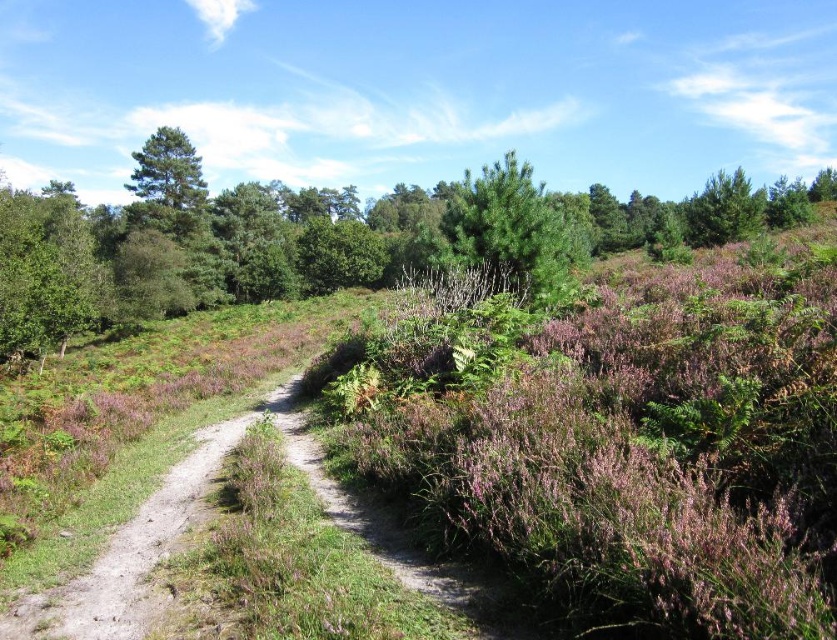
You are standing at the center of the dirt path in the heathland scene. You want to walk towards the green leafy tree at left. Which direction should you head?

The green leafy tree at left is located at the left side of the scene, so you should head towards the left direction to reach it.

You are planning a photography session and want to capture both the green leafy tree at left and the green matte tree at center in your shot. Which tree should you position closer to the camera to ensure both are fully visible in the frame?

To ensure both the green leafy tree at left and the green matte tree at center are fully visible in the frame, position the shorter green leafy tree at left closer to the camera since it is shorter than the green matte tree at center. This way, the height difference will be minimized, allowing both trees to fit within the photograph.

You are planning a photography session and want to capture both the green leafy tree at left and the green matte tree at center in your frame. Which tree should you focus on first if you want to ensure both are in the same shot?

You should focus on the green leafy tree at left first because it is bigger and will require more space in the frame to capture its entirety while still including the smaller green matte tree at center.